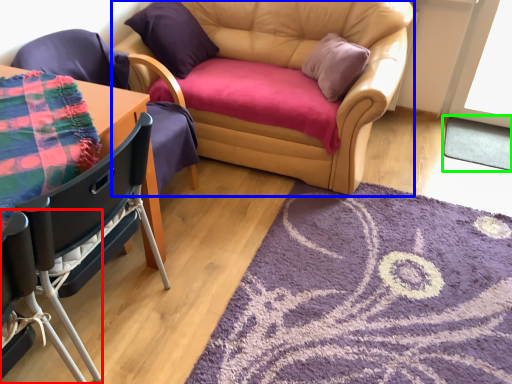
Question: Estimate the real-world distances between objects in this image. Which object is closer to chair (highlighted by a red box), studio couch (highlighted by a blue box) or mat (highlighted by a green box)?

Choices:
 (A) studio couch
 (B) mat

Answer: (A)